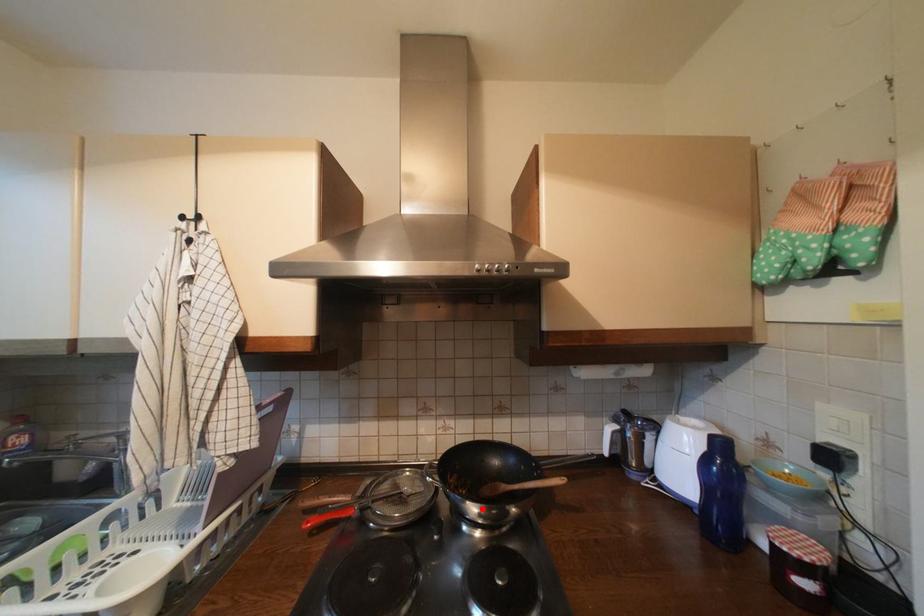
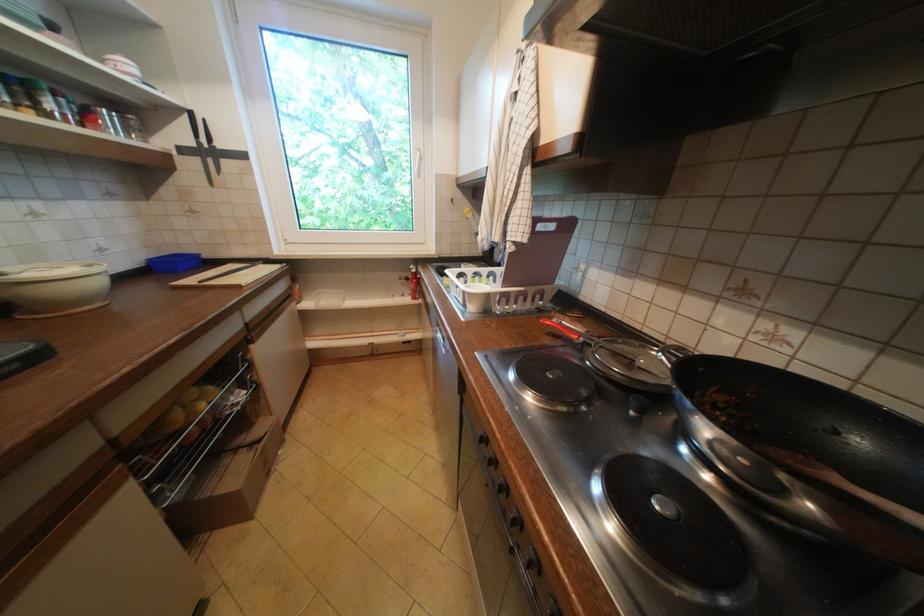
Where in the second image is the point corresponding to the highlighted location from the first image?

(715, 430)